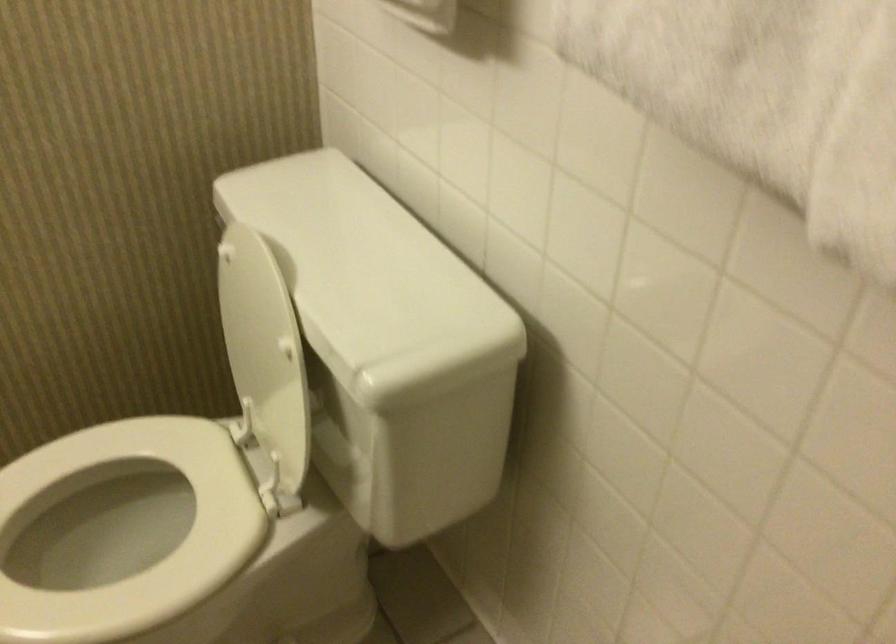
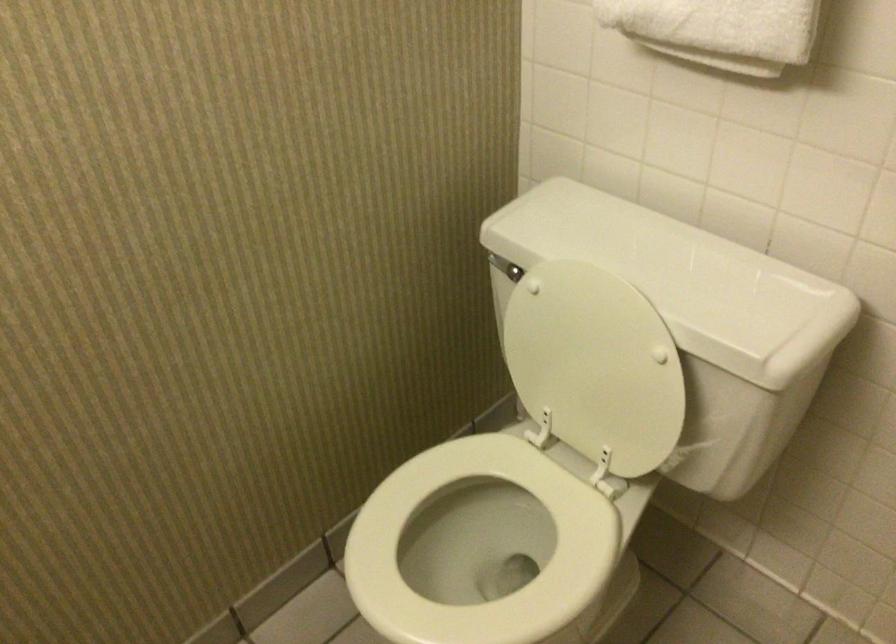
Question: Which direction would the cameraman need to move to produce the second image? Reply with the corresponding letter.

Choices:
 (A) Left
 (B) Right
 (C) Forward
 (D) Backward

Answer: (A)